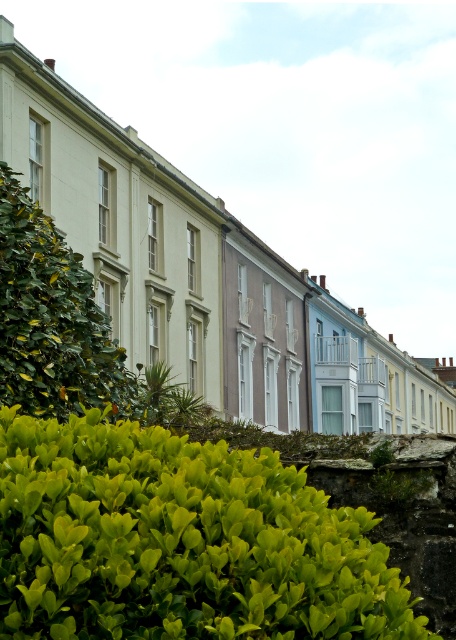
You are standing in front of the row of terraced houses and want to know the location of the green leafy hedge at lower left. Can you tell me its coordinates?

The green leafy hedge at lower left is located at coordinates point (180, 541).

Based on the photo, you are standing in front of the row of terraced houses and notice two green leafy hedges. One is labeled as the green leafy hedge at lower left and the other as the green leafy hedge at left. Which hedge is nearer to you?

The green leafy hedge at lower left is closer to the viewer than the green leafy hedge at left.

You are standing in front of the row of terraced houses and want to place a small garden ornament between the two points, point (145, 616) and point (24, 317). Which point is closer to you where you should start placing the ornament?

Point (145, 616) is closer to the viewer than point (24, 317), so you should start placing the ornament near point (145, 616) first.